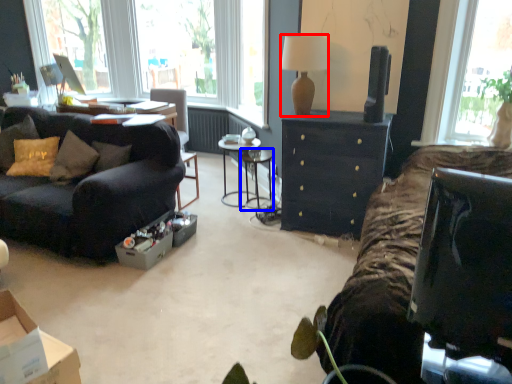
Question: Among these objects, which one is farthest to the camera, lamp (highlighted by a red box) or table (highlighted by a blue box)?

Choices:
 (A) lamp
 (B) table

Answer: (B)